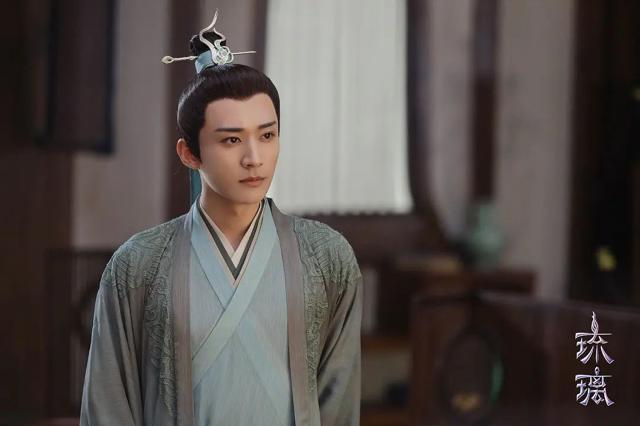
At what (x,y) coordinates should I click in order to perform the action: click on vase. Please return your answer as a coordinate pair (x, y). Looking at the image, I should click on (484, 241).